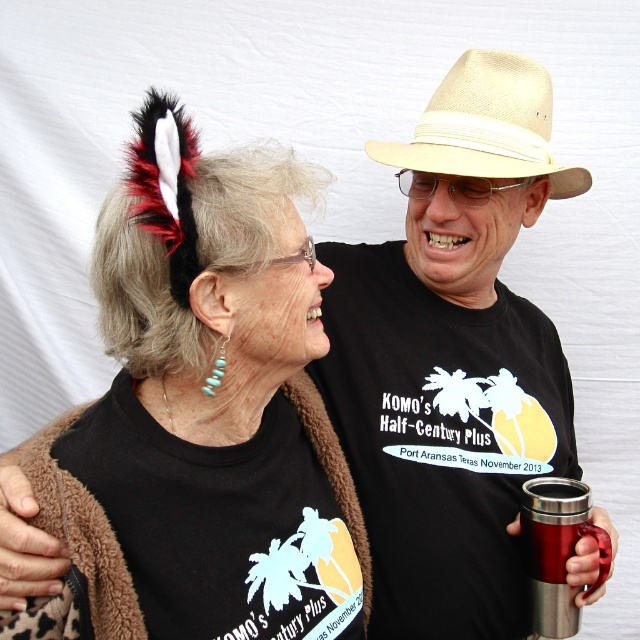
You are a photographer setting up for a portrait session. You notice the black feather headband at upper left and the stainless steel cup at right in the frame. Based on their heights, which object should you adjust to ensure both are visible in the photo?

The black feather headband at upper left is much taller than the stainless steel cup at right, so you should lower the angle of the camera or move the headband slightly downward to ensure both objects are fully visible in the photo.

You are a photographer setting up for a portrait session. You need to ensure that the black feather headband at upper left and the beige straw hat at upper center are both visible in the frame. Based on their positions, which object should you adjust first to ensure both are in the shot?

The black feather headband at upper left is to the left of the beige straw hat at upper center, so you should adjust the camera angle or position to first ensure the leftmost object, the black feather headband at upper left, is fully visible before checking the right side for the beige straw hat at upper center.

You are a photographer trying to capture a photo of both individuals. You notice two points marked in the scene. The first point is at coordinate point(483, 65) and the second is at point(536, 548). Since you want to ensure both subjects are in focus, you need to know which point is closer to the camera. Can you determine which point is closer?

Point(536, 548) is closer to the camera than point(483, 65) because the description states that point(483, 65) is behind point(536, 548).